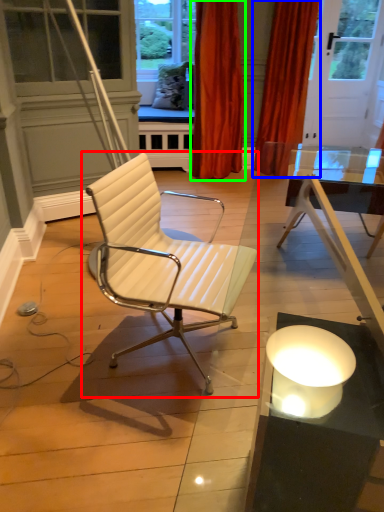
Question: Which object is positioned farthest from chair (highlighted by a red box)? Select from curtain (highlighted by a blue box) and curtain (highlighted by a green box).

Choices:
 (A) curtain
 (B) curtain

Answer: (A)